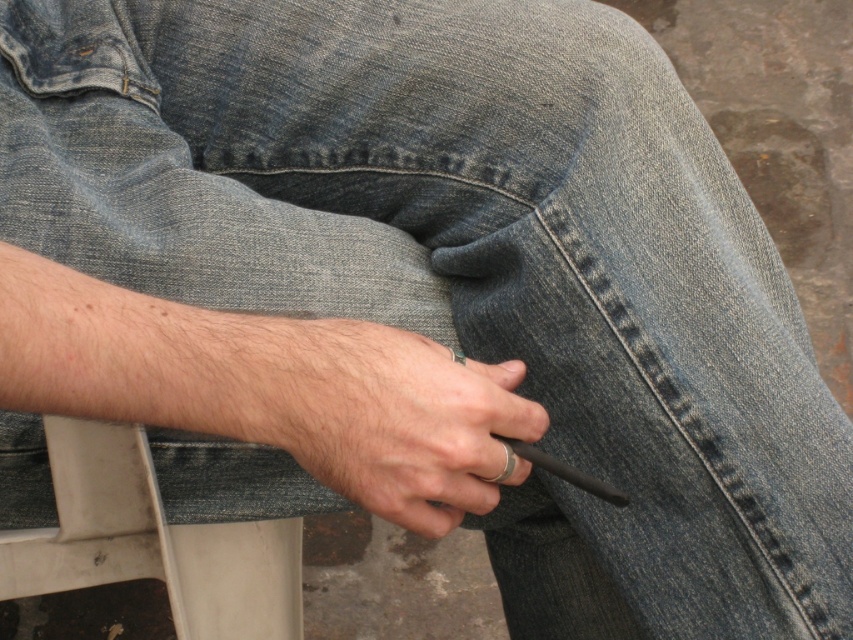
Who is more forward, (444, 445) or (601, 493)?

Point (444, 445) is more forward.

What do you see at coordinates (397, 420) in the screenshot? I see `matte black pen at center` at bounding box center [397, 420].

In order to click on matte black pen at center in this screenshot , I will do `click(397, 420)`.

Who is lower down, white plastic chair at lower left or black matte cigarette at center?

Positioned lower is white plastic chair at lower left.

Who is more distant from viewer, (144, 552) or (622, 492)?

The point (144, 552) is more distant.

The image size is (853, 640). In order to click on white plastic chair at lower left in this screenshot , I will do `click(152, 541)`.

Does matte black pen at center appear over white plastic chair at lower left?

Yes, matte black pen at center is above white plastic chair at lower left.

Identify the location of matte black pen at center. click(x=397, y=420).

You are a GUI agent. You are given a task and a screenshot of the screen. Output one action in this format:
    pyautogui.click(x=<x>, y=<y>)
    Task: Click on the matte black pen at center
    The width and height of the screenshot is (853, 640).
    Given the screenshot: What is the action you would take?
    pyautogui.click(x=397, y=420)